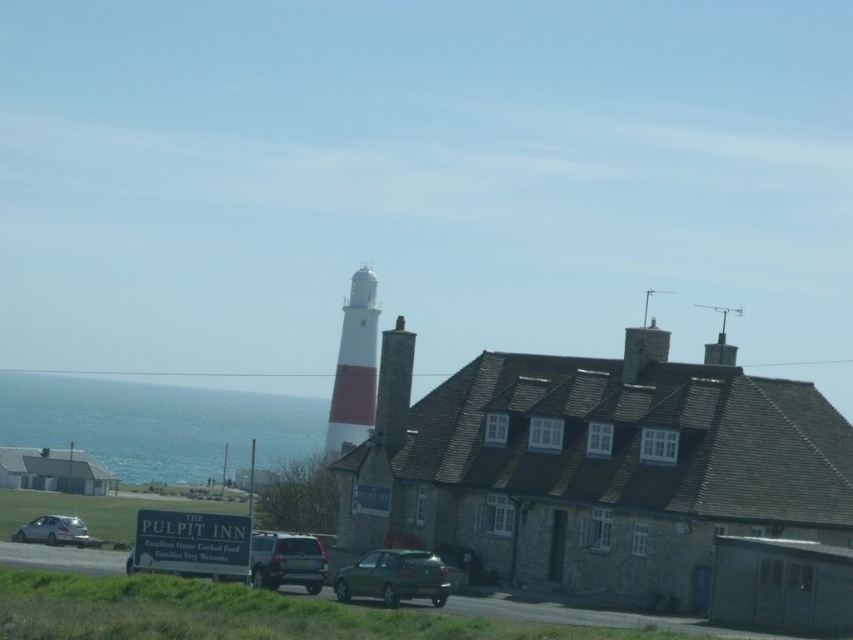
You are a delivery driver who needs to park your vehicle in the parking lot shown in the image. You see a green matte hatchback at center and a satin silver suv at center. Which vehicle should you avoid parking directly in front of to ensure you can exit easily?

You should avoid parking directly in front of the green matte hatchback at center because the satin silver suv at center is behind it. Parking in front of the hatchback would block the SUV, making it difficult for the SUV to exit.

You are driving a car and want to park in the parking lot near the lighthouse and The Pulpit Inn. There is a satin silver suv at center and a silver metallic car at lower left. Can you safely park your car between them without needing to move either vehicle?

The distance between the satin silver suv at center and the silver metallic car at lower left is 80.54 feet. Since this distance is more than enough to accommodate your car, you can safely park between them without moving either vehicle.

You are standing at the coast and see the blue water at lower left and the silver metallic car at lower left. Which one appears taller from your viewpoint?

The blue water at lower left appears taller than the silver metallic car at lower left.